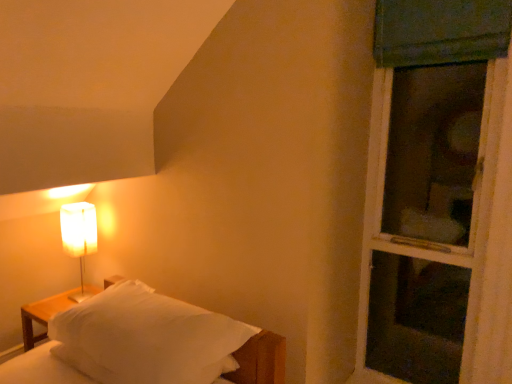
Question: Is white soft bed at lower left positioned with its back to green fabric screen door at right?

Choices:
 (A) no
 (B) yes

Answer: (A)

Question: Would you say white soft bed at lower left is a long distance from green fabric screen door at right?

Choices:
 (A) no
 (B) yes

Answer: (B)

Question: From the image's perspective, is white soft bed at lower left under green fabric screen door at right?

Choices:
 (A) no
 (B) yes

Answer: (B)

Question: Is green fabric screen door at right a part of white soft bed at lower left?

Choices:
 (A) no
 (B) yes

Answer: (A)

Question: From a real-world perspective, does white soft bed at lower left stand above green fabric screen door at right?

Choices:
 (A) no
 (B) yes

Answer: (A)

Question: Is white soft bed at lower left shorter than green fabric screen door at right?

Choices:
 (A) no
 (B) yes

Answer: (B)

Question: Is green fabric screen door at right oriented towards white paper lampshade at left?

Choices:
 (A) yes
 (B) no

Answer: (B)

Question: Would you say green fabric screen door at right contains white paper lampshade at left?

Choices:
 (A) yes
 (B) no

Answer: (B)

Question: Is green fabric screen door at right further to the viewer compared to white paper lampshade at left?

Choices:
 (A) yes
 (B) no

Answer: (B)

Question: Can you confirm if green fabric screen door at right is positioned to the left of white paper lampshade at left?

Choices:
 (A) yes
 (B) no

Answer: (B)

Question: Is green fabric screen door at right smaller than white paper lampshade at left?

Choices:
 (A) no
 (B) yes

Answer: (A)

Question: Is green fabric screen door at right oriented away from white paper lampshade at left?

Choices:
 (A) yes
 (B) no

Answer: (B)

Question: Is white paper lampshade at left closer to the viewer compared to white soft bed at lower left?

Choices:
 (A) no
 (B) yes

Answer: (A)